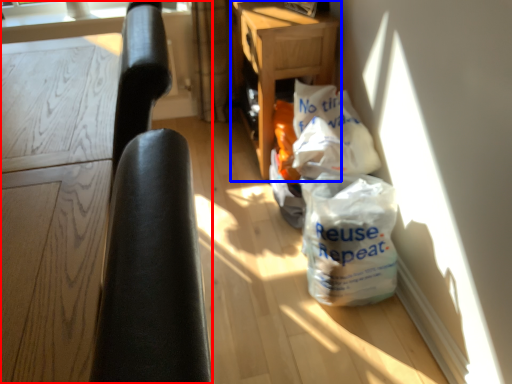
Question: Which object appears closest to the camera in this image, furniture (highlighted by a red box) or table (highlighted by a blue box)?

Choices:
 (A) furniture
 (B) table

Answer: (A)